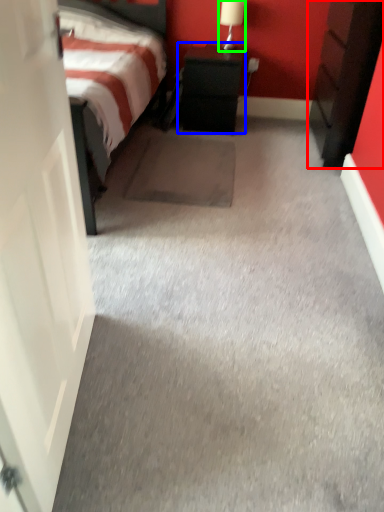
Question: Estimate the real-world distances between objects in this image. Which object is farther from nightstand (highlighted by a red box), nightstand (highlighted by a blue box) or table lamp (highlighted by a green box)?

Choices:
 (A) nightstand
 (B) table lamp

Answer: (B)